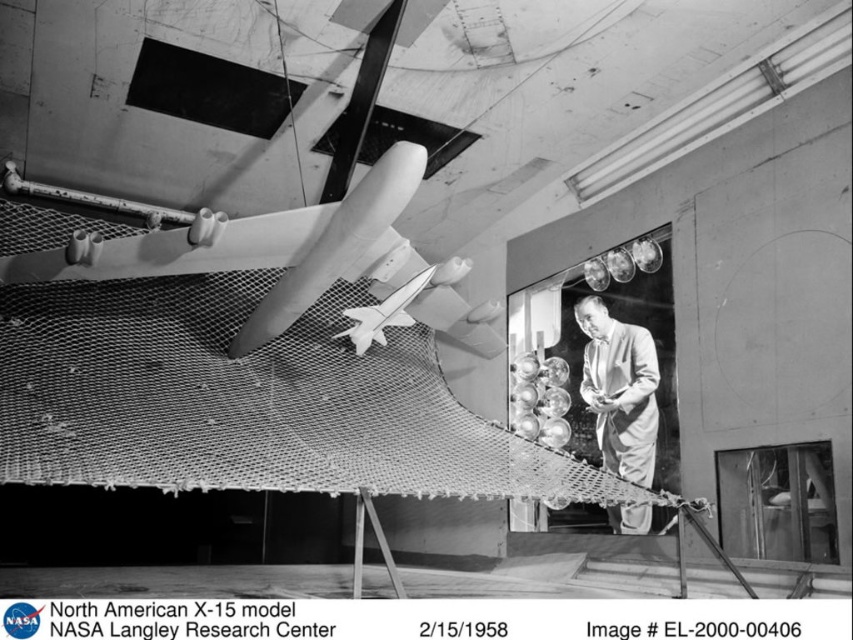
You are an engineer observing the North American X15 model in the wind tunnel. You notice the smooth white airplane at center and the light gray suit at center. Which object is taller?

The light gray suit at center is taller than the smooth white airplane at center.

You are an engineer standing in the facility where the smooth white airplane at center is suspended. You need to measure the distance from your position to the airplane. If your measuring tool can only reach up to 3 meters, will it be sufficient?

The distance between the smooth white airplane at center and the camera is 3.77 meters. Since your measuring tool can only reach up to 3 meters, it will not be sufficient to measure the distance to the smooth white airplane at center.